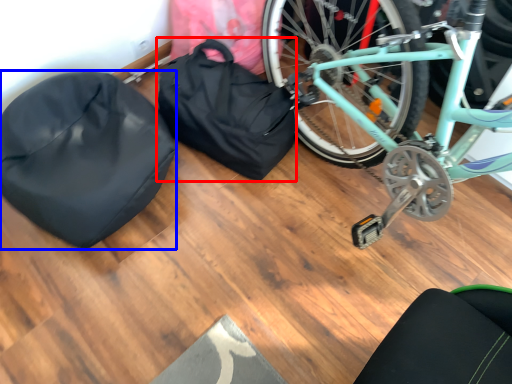
Question: Which object appears closest to the camera in this image, bag (highlighted by a red box) or sleeping bag (highlighted by a blue box)?

Choices:
 (A) bag
 (B) sleeping bag

Answer: (B)